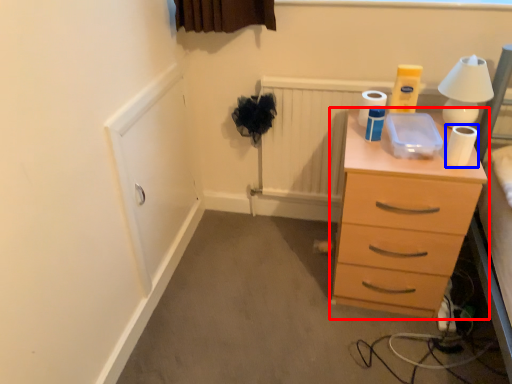
Question: Which of the following is the farthest to the observer, chest of drawers (highlighted by a red box) or toilet paper (highlighted by a blue box)?

Choices:
 (A) chest of drawers
 (B) toilet paper

Answer: (B)